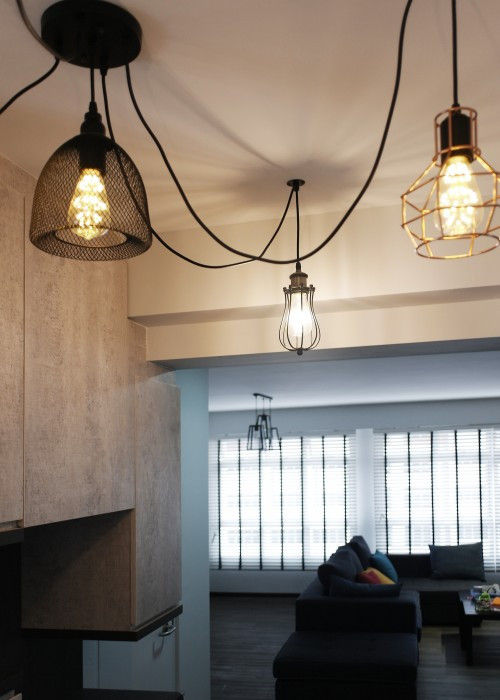
Identify the location of golden thick wire light fixture. Image resolution: width=500 pixels, height=700 pixels. (420, 213).